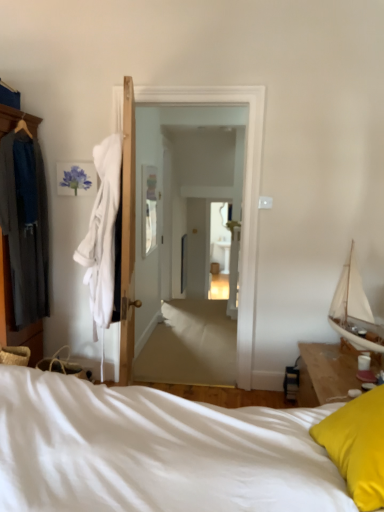
Question: Is yellow fabric pillow at lower right beside dark gray fabric robe at left?

Choices:
 (A) no
 (B) yes

Answer: (A)

Question: Is yellow fabric pillow at lower right looking in the opposite direction of dark gray fabric robe at left?

Choices:
 (A) yes
 (B) no

Answer: (B)

Question: Is dark gray fabric robe at left inside yellow fabric pillow at lower right?

Choices:
 (A) no
 (B) yes

Answer: (A)

Question: Is yellow fabric pillow at lower right closer to the viewer compared to dark gray fabric robe at left?

Choices:
 (A) yes
 (B) no

Answer: (A)

Question: Is yellow fabric pillow at lower right smaller than dark gray fabric robe at left?

Choices:
 (A) no
 (B) yes

Answer: (B)

Question: Is yellow fabric pillow at lower right further to camera compared to dark gray fabric robe at left?

Choices:
 (A) yes
 (B) no

Answer: (B)

Question: From the image's perspective, would you say dark gray fabric robe at left is positioned over white glossy door at center?

Choices:
 (A) no
 (B) yes

Answer: (B)

Question: Is dark gray fabric robe at left outside white glossy door at center?

Choices:
 (A) yes
 (B) no

Answer: (A)

Question: From the image's perspective, is dark gray fabric robe at left located beneath white glossy door at center?

Choices:
 (A) yes
 (B) no

Answer: (B)

Question: Is dark gray fabric robe at left smaller than white glossy door at center?

Choices:
 (A) no
 (B) yes

Answer: (B)

Question: Is dark gray fabric robe at left to the right of white glossy door at center from the viewer's perspective?

Choices:
 (A) yes
 (B) no

Answer: (B)

Question: Is dark gray fabric robe at left next to white glossy door at center?

Choices:
 (A) yes
 (B) no

Answer: (B)

Question: Is white soft robe at left shorter than yellow fabric pillow at lower right?

Choices:
 (A) yes
 (B) no

Answer: (B)